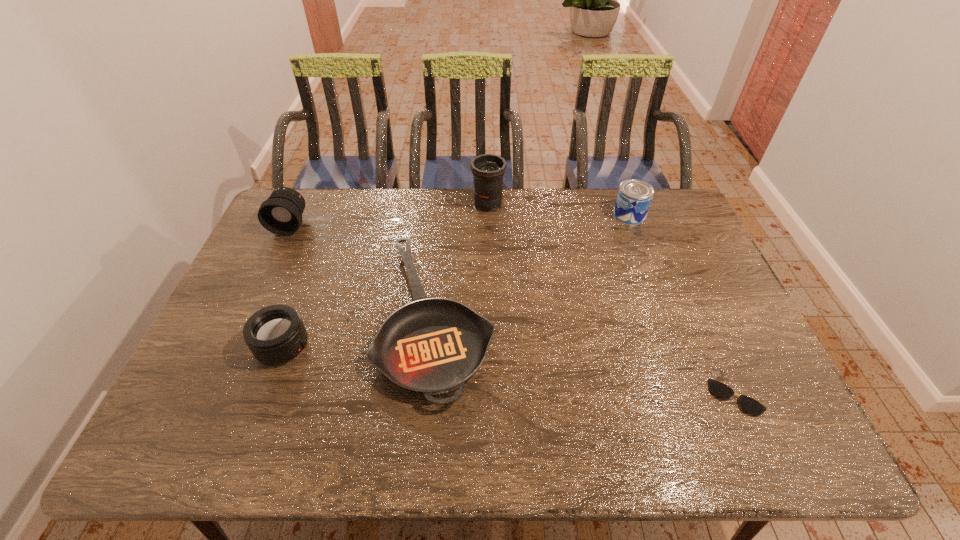
Identify the location of free space located on the front label of the fourth shortest object. This screenshot has width=960, height=540. (533, 215).

At what (x,y) coordinates should I click in order to perform the action: click on free location located on the front label of the fourth shortest object. Please return your answer as a coordinate pair (x, y). The width and height of the screenshot is (960, 540). Looking at the image, I should click on (553, 215).

The height and width of the screenshot is (540, 960). What are the coordinates of `vacant space located on the front label of the fourth shortest object` in the screenshot? It's located at (579, 215).

At what (x,y) coordinates should I click in order to perform the action: click on vacant space located 0.240m on the side of the third shortest object with brand markings and control switches. Please return your answer as a coordinate pair (x, y). Looking at the image, I should click on (402, 346).

This screenshot has width=960, height=540. Identify the location of vacant point located 0.110m on the left of the frying pan. (339, 318).

Locate an element on the screen. This screenshot has height=540, width=960. blank area located on the back of the spectacles is located at coordinates (682, 275).

This screenshot has height=540, width=960. What are the coordinates of `can present at the far edge` in the screenshot? It's located at (634, 197).

This screenshot has width=960, height=540. In order to click on can located at the right edge in this screenshot , I will do `click(634, 197)`.

At what (x,y) coordinates should I click in order to perform the action: click on spectacles that is at the right edge. Please return your answer as a coordinate pair (x, y). Looking at the image, I should click on (719, 389).

In order to click on object that is at the far left corner in this screenshot , I will do `click(281, 214)`.